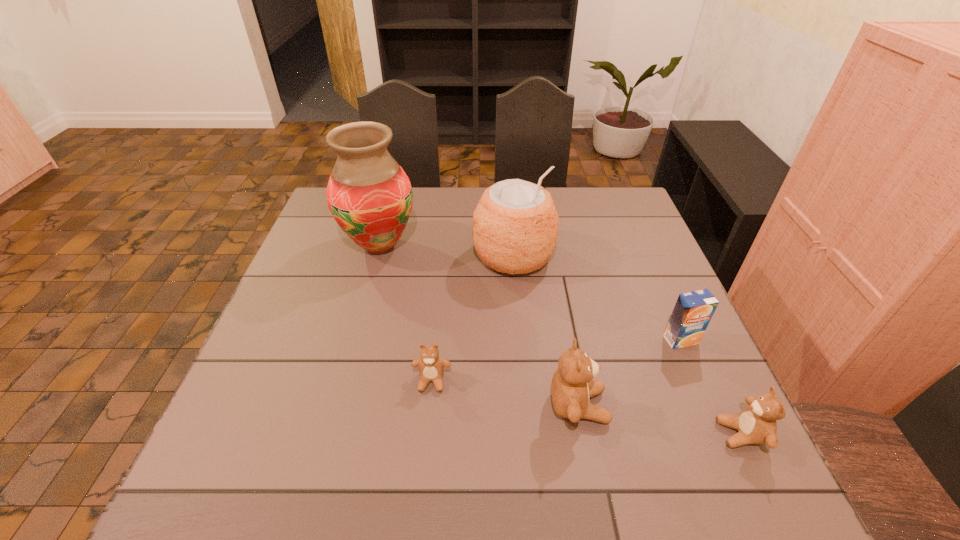
Where is `teddy bear that stands as the closest to the second teddy bear from left to right`? The height and width of the screenshot is (540, 960). teddy bear that stands as the closest to the second teddy bear from left to right is located at coordinates (431, 366).

Select which teddy bear is the closest to the third farthest object. Please provide its 2D coordinates. Your answer should be formatted as a tuple, i.e. [(x, y)], where the tuple contains the x and y coordinates of a point satisfying the conditions above.

[(756, 424)]